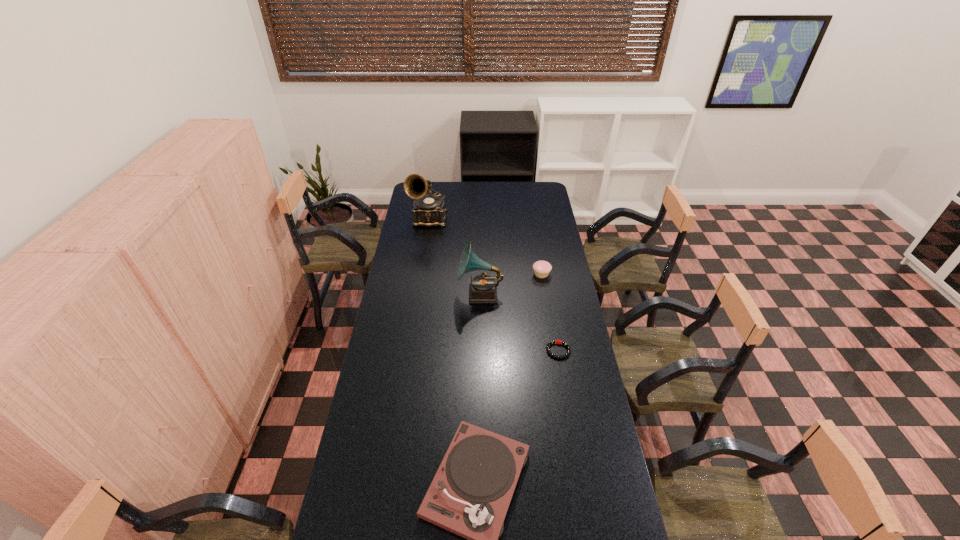
Locate an element on the screen. The height and width of the screenshot is (540, 960). the leftmost object is located at coordinates (429, 209).

The image size is (960, 540). What are the coordinates of `the leftmost phonograph_record` in the screenshot? It's located at (429, 209).

The width and height of the screenshot is (960, 540). What are the coordinates of `the second farthest phonograph_record` in the screenshot? It's located at (482, 289).

You are a GUI agent. You are given a task and a screenshot of the screen. Output one action in this format:
    pyautogui.click(x=<x>, y=<y>)
    Task: Click on the cupcake
    The width and height of the screenshot is (960, 540).
    Given the screenshot: What is the action you would take?
    pyautogui.click(x=542, y=269)

Where is `the fourth nearest object`? Image resolution: width=960 pixels, height=540 pixels. the fourth nearest object is located at coordinates (542, 269).

In order to click on the fourth farthest object in this screenshot , I will do `click(564, 343)`.

The height and width of the screenshot is (540, 960). Identify the location of the shortest object. (564, 343).

Find the location of `free space located on the horn of the farthest object`. free space located on the horn of the farthest object is located at coordinates (422, 259).

Image resolution: width=960 pixels, height=540 pixels. I want to click on vacant space located 0.290m from the horn of the third farthest object, so click(396, 294).

What are the coordinates of `free space located from the horn of the third farthest object` in the screenshot? It's located at (407, 294).